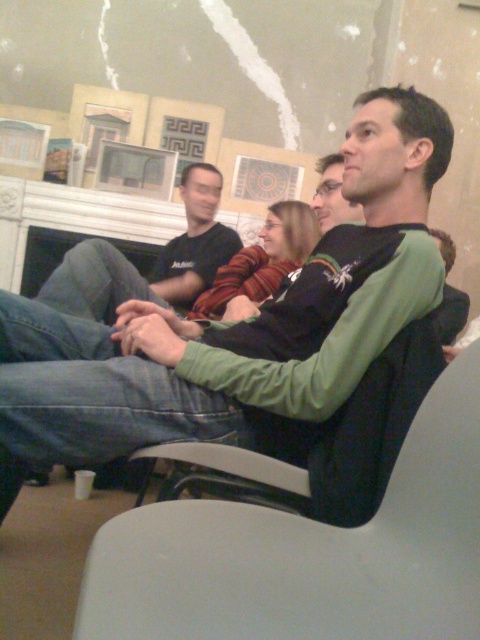
Question: Among these objects, which one is farthest from the camera?

Choices:
 (A) green fleece sweater at center
 (B) white plastic swivel chair at lower center
 (C) black cotton shirt at upper center

Answer: (C)

Question: Does green fleece sweater at center appear under black cotton shirt at upper center?

Choices:
 (A) no
 (B) yes

Answer: (B)

Question: Which object appears closest to the camera in this image?

Choices:
 (A) white plastic swivel chair at lower center
 (B) black cotton shirt at upper center
 (C) green fleece sweater at center

Answer: (A)

Question: Which point is farther to the camera?

Choices:
 (A) [205, 182]
 (B) [169, 637]
 (C) [97, 387]

Answer: (A)

Question: Is white plastic swivel chair at lower center closer to the viewer compared to black cotton shirt at upper center?

Choices:
 (A) no
 (B) yes

Answer: (B)

Question: Can you confirm if green fleece sweater at center is positioned below black cotton shirt at upper center?

Choices:
 (A) yes
 (B) no

Answer: (A)